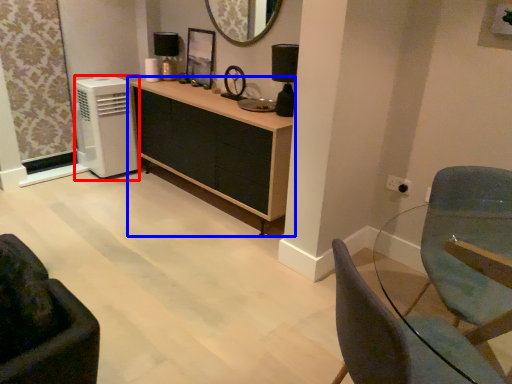
Question: Which object appears farthest to the camera in this image, air conditioning (highlighted by a red box) or cabinetry (highlighted by a blue box)?

Choices:
 (A) air conditioning
 (B) cabinetry

Answer: (A)